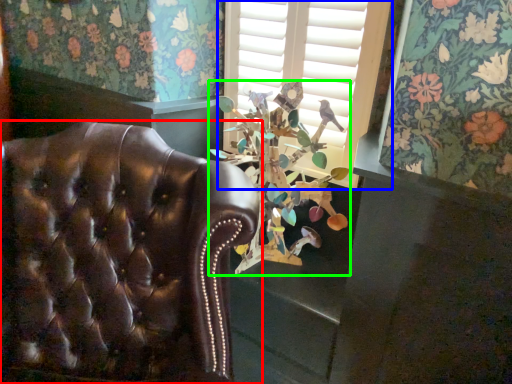
Question: Which object is the closest to the chair (highlighted by a red box)? Choose among these: window (highlighted by a blue box) or floral arrangement (highlighted by a green box).

Choices:
 (A) window
 (B) floral arrangement

Answer: (B)